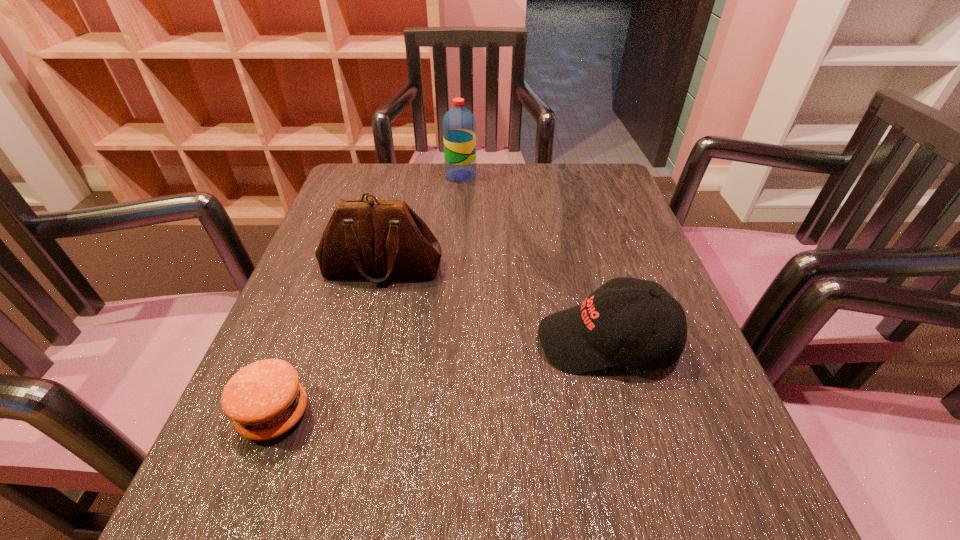
Identify the location of vacant region at the far left corner. (400, 179).

At what (x,y) coordinates should I click in order to perform the action: click on vacant space at the far right corner of the desktop. Please return your answer as a coordinate pair (x, y). Looking at the image, I should click on (563, 191).

At what (x,y) coordinates should I click in order to perform the action: click on vacant space at the near right corner of the desktop. Please return your answer as a coordinate pair (x, y). Looking at the image, I should click on (721, 499).

Find the location of a particular element. The height and width of the screenshot is (540, 960). free space between the patty and the water bottle is located at coordinates (368, 295).

Find the location of a particular element. vacant space in between the farthest object and the patty is located at coordinates (368, 295).

You are a GUI agent. You are given a task and a screenshot of the screen. Output one action in this format:
    pyautogui.click(x=<x>, y=<y>)
    Task: Click on the vacant area between the water bottle and the nearest object
    This screenshot has height=540, width=960.
    Given the screenshot: What is the action you would take?
    pyautogui.click(x=368, y=295)

Where is `free space between the nearest object and the second nearest object`? The width and height of the screenshot is (960, 540). free space between the nearest object and the second nearest object is located at coordinates (441, 378).

At what (x,y) coordinates should I click in order to perform the action: click on vacant area that lies between the nearest object and the farthest object. Please return your answer as a coordinate pair (x, y). The height and width of the screenshot is (540, 960). Looking at the image, I should click on (368, 295).

You are a GUI agent. You are given a task and a screenshot of the screen. Output one action in this format:
    pyautogui.click(x=<x>, y=<y>)
    Task: Click on the unoccupied position between the water bottle and the nearest object
    This screenshot has height=540, width=960.
    Given the screenshot: What is the action you would take?
    pyautogui.click(x=368, y=295)

Find the location of a particular element. Image resolution: width=960 pixels, height=540 pixels. free spot between the second tallest object and the patty is located at coordinates (328, 341).